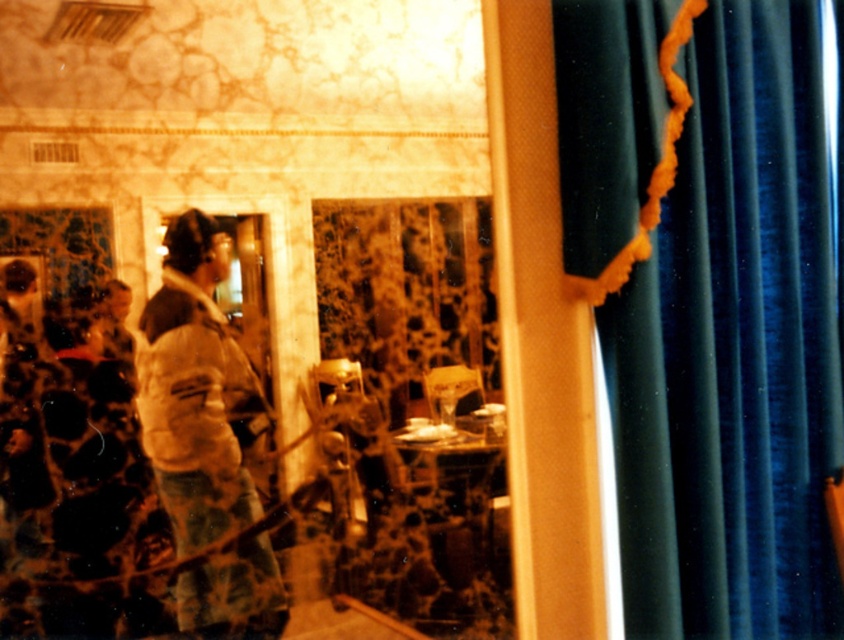
Question: Which point appears farthest from the camera in this image?

Choices:
 (A) (147, 390)
 (B) (704, 556)

Answer: (B)

Question: Can you confirm if velvet blue curtain at right is thinner than white fuzzy jacket at left?

Choices:
 (A) yes
 (B) no

Answer: (B)

Question: Is velvet blue curtain at right bigger than white fuzzy jacket at left?

Choices:
 (A) no
 (B) yes

Answer: (B)

Question: Is velvet blue curtain at right closer to the viewer compared to white fuzzy jacket at left?

Choices:
 (A) yes
 (B) no

Answer: (B)

Question: Which point is closer to the camera?

Choices:
 (A) velvet blue curtain at right
 (B) white fuzzy jacket at left

Answer: (B)